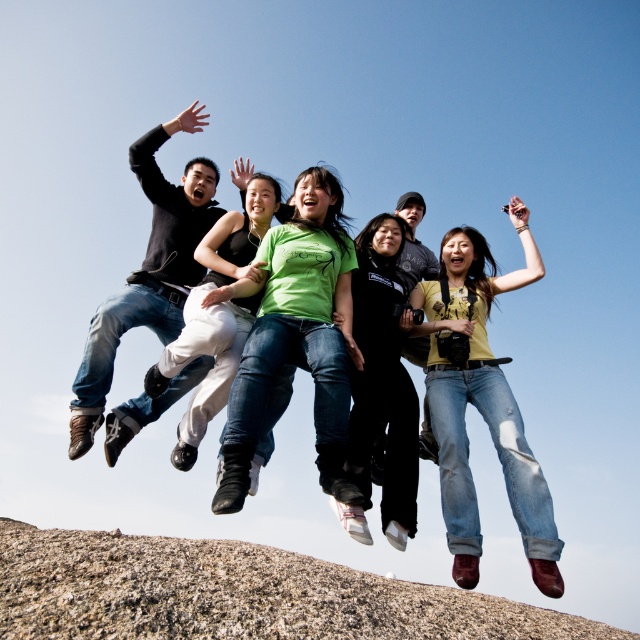
Which is in front, point (240, 481) or point (195, 316)?

Point (240, 481) is in front.

Which is more to the right, green matte shirt at center or matte green shirt at center?

green matte shirt at center

Is point (240, 445) in front of point (257, 236)?

Yes.

Where is `green matte shirt at center`? This screenshot has height=640, width=640. green matte shirt at center is located at coordinates (298, 339).

Who is shorter, granite rock at lower center or denim jeans at center?

denim jeans at center is shorter.

Can you confirm if granite rock at lower center is shorter than denim jeans at center?

No.

Locate an element on the screen. This screenshot has height=640, width=640. granite rock at lower center is located at coordinates (236, 593).

Can you confirm if green matte shirt at center is bigger than denim jeans at center?

Yes.

From the picture: Can you confirm if green matte shirt at center is positioned above denim jeans at center?

Actually, green matte shirt at center is below denim jeans at center.

Identify the location of green matte shirt at center. (298, 339).